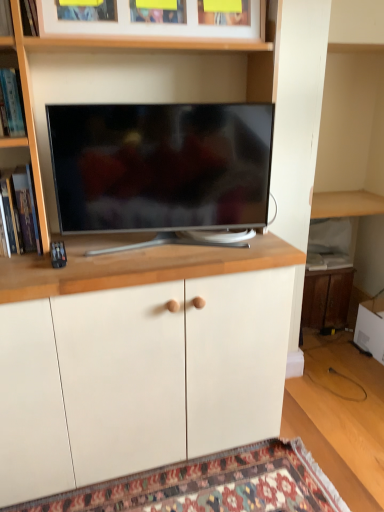
The width and height of the screenshot is (384, 512). I want to click on vacant space underneath matte black tv at center (from a real-world perspective), so click(x=165, y=245).